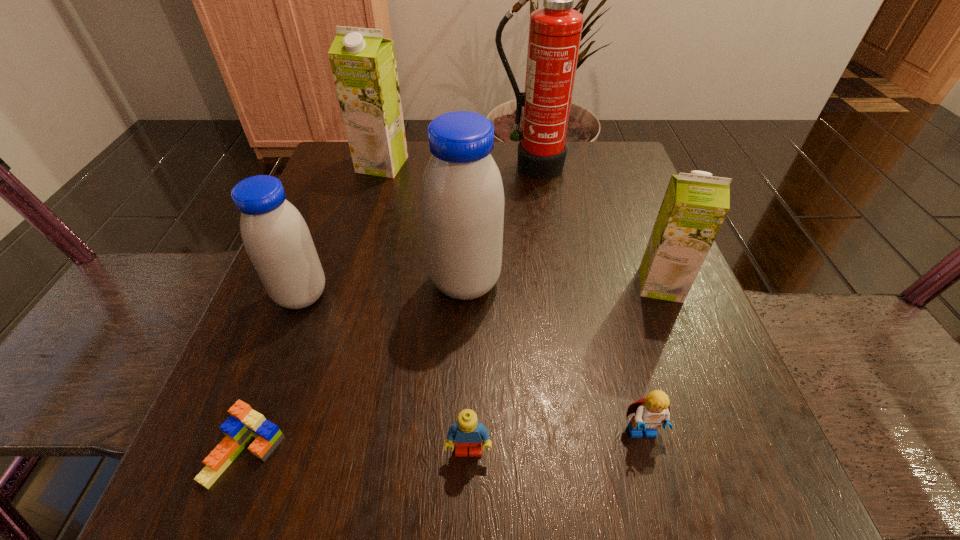
Locate an element on the screen. Image resolution: width=960 pixels, height=540 pixels. free space between the rightmost Lego and the second Lego from right to left is located at coordinates (556, 442).

The height and width of the screenshot is (540, 960). I want to click on vacant space that is in between the leftmost Lego and the blue Lego, so click(357, 451).

Locate an element on the screen. The image size is (960, 540). free spot between the red fire extinguisher and the rightmost Lego is located at coordinates (587, 300).

Where is `free space between the rightmost Lego and the shortest Lego`? The width and height of the screenshot is (960, 540). free space between the rightmost Lego and the shortest Lego is located at coordinates (444, 443).

This screenshot has width=960, height=540. I want to click on blank region between the smaller blue soya milk and the rightmost Lego, so click(472, 364).

Locate an element on the screen. Image resolution: width=960 pixels, height=540 pixels. free space between the rightmost object and the rightmost Lego is located at coordinates (652, 359).

Where is `free spot between the left blue soya milk and the farther green soya milk`? free spot between the left blue soya milk and the farther green soya milk is located at coordinates (342, 230).

Identify which object is located as the second nearest to the bigger blue soya milk. Please provide its 2D coordinates. Your answer should be formatted as a tuple, i.e. [(x, y)], where the tuple contains the x and y coordinates of a point satisfying the conditions above.

[(467, 432)]

Identify the location of object that stands as the sixth closest to the second Lego from right to left. (555, 30).

Locate which soya milk ranks fourth in proximity to the tallest object. Please provide its 2D coordinates. Your answer should be formatted as a tuple, i.e. [(x, y)], where the tuple contains the x and y coordinates of a point satisfying the conditions above.

[(276, 237)]